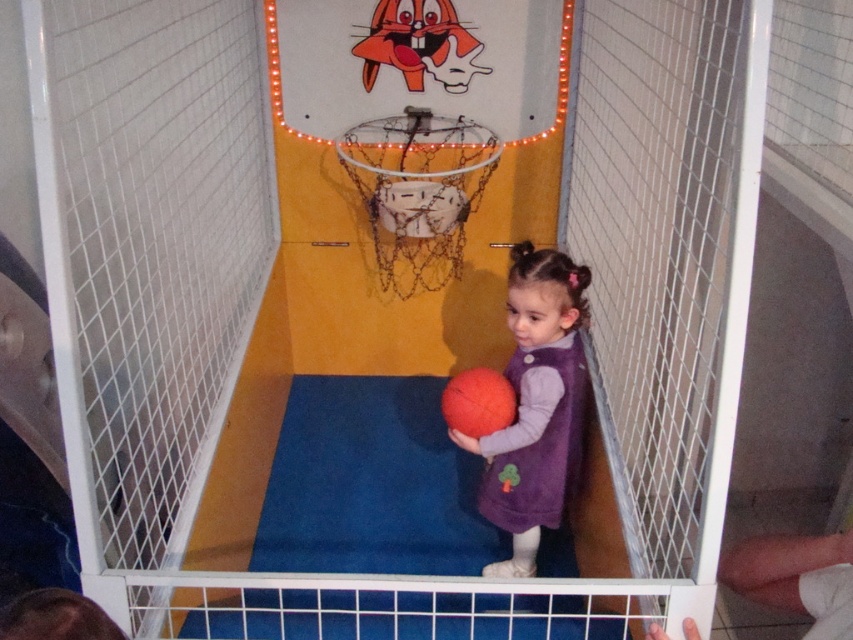
Question: Is purple fabric dress at center bigger than white mesh basketball hoop at center?

Choices:
 (A) yes
 (B) no

Answer: (B)

Question: Observing the image, what is the correct spatial positioning of purple fabric dress at center in reference to rubber/spongy basketball at center?

Choices:
 (A) below
 (B) above

Answer: (A)

Question: Estimate the real-world distances between objects in this image. Which object is farther from the purple fabric dress at center?

Choices:
 (A) rubber/spongy basketball at center
 (B) white mesh basketball hoop at center

Answer: (B)

Question: Does white mesh basketball hoop at center come behind rubber/spongy basketball at center?

Choices:
 (A) yes
 (B) no

Answer: (A)

Question: Which point appears farthest from the camera in this image?

Choices:
 (A) (491, 401)
 (B) (428, 280)
 (C) (579, 444)

Answer: (B)

Question: Which object appears farthest from the camera in this image?

Choices:
 (A) purple fabric dress at center
 (B) rubber/spongy basketball at center
 (C) white mesh basketball hoop at center

Answer: (C)